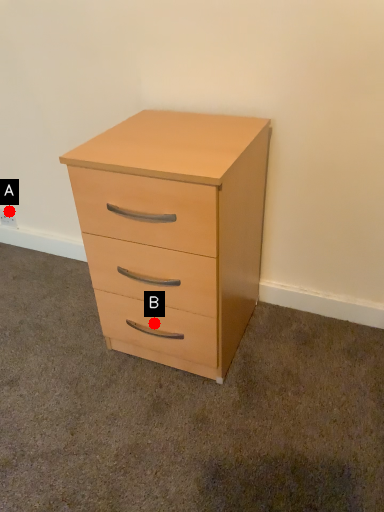
Question: Two points are circled on the image, labeled by A and B beside each circle. Among these points, which one is farthest from the camera?

Choices:
 (A) A is further
 (B) B is further

Answer: (A)